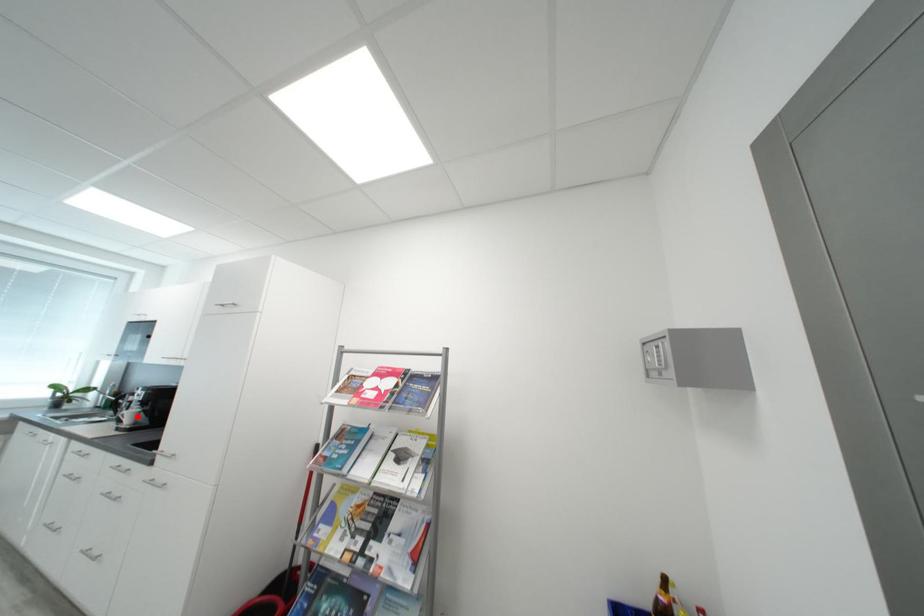
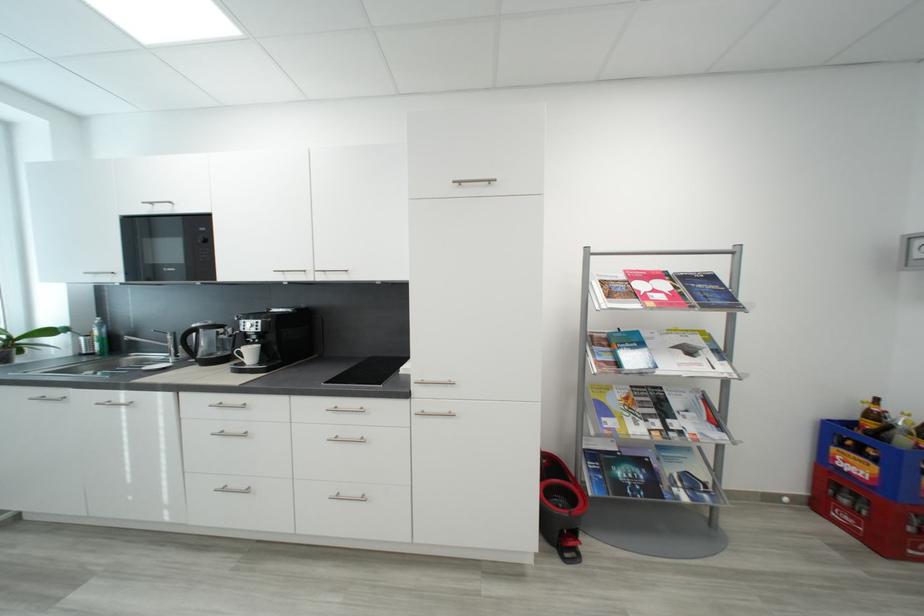
Where in the second image is the point corresponding to the highlighted location from the first image?

(257, 354)